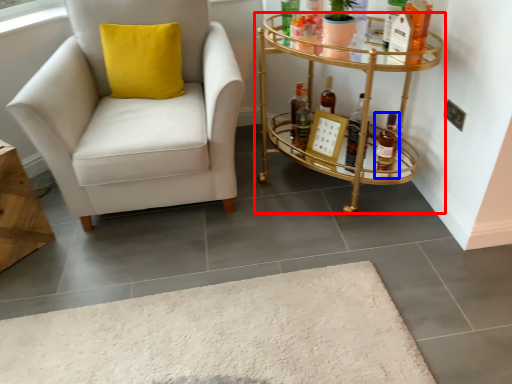
Question: Which of the following is the farthest to the observer, table (highlighted by a red box) or bottle (highlighted by a blue box)?

Choices:
 (A) table
 (B) bottle

Answer: (B)